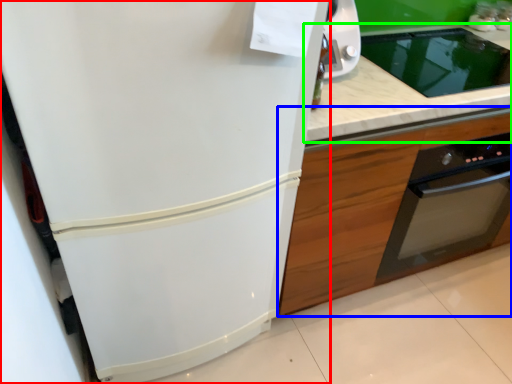
Question: Which object is positioned farthest from refrigerator (highlighted by a red box)? Select from cabinetry (highlighted by a blue box) and countertop (highlighted by a green box).

Choices:
 (A) cabinetry
 (B) countertop

Answer: (B)